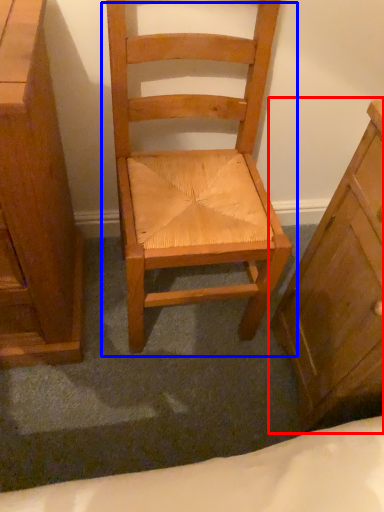
Question: Which object appears closest to the camera in this image, chest of drawers (highlighted by a red box) or chair (highlighted by a blue box)?

Choices:
 (A) chest of drawers
 (B) chair

Answer: (A)